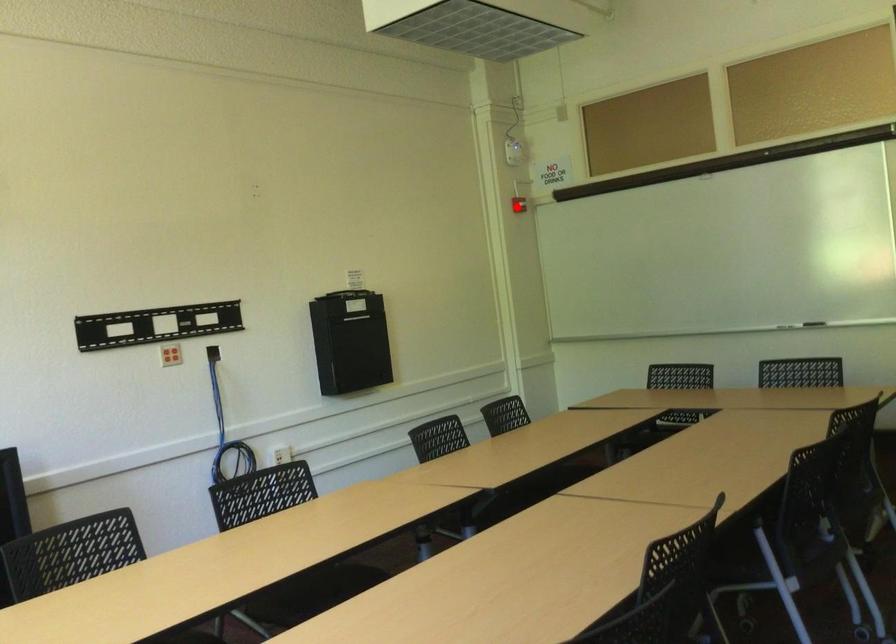
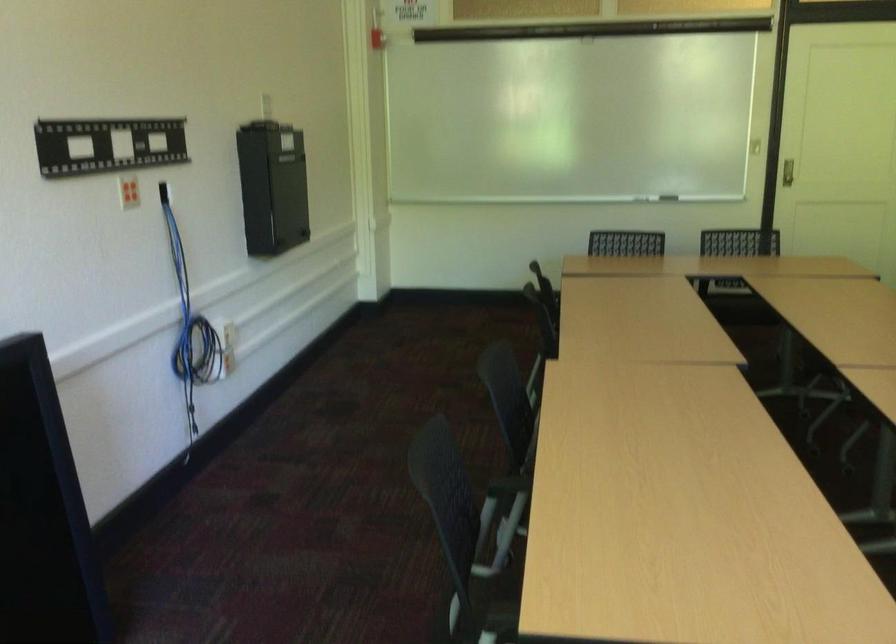
Question: A red point is marked in image1. In image2, is the corresponding 3D point closer to the camera or farther? Reply with the corresponding letter.

Choices:
 (A) The corresponding 3D point is closer.
 (B) The corresponding 3D point is farther.

Answer: (A)